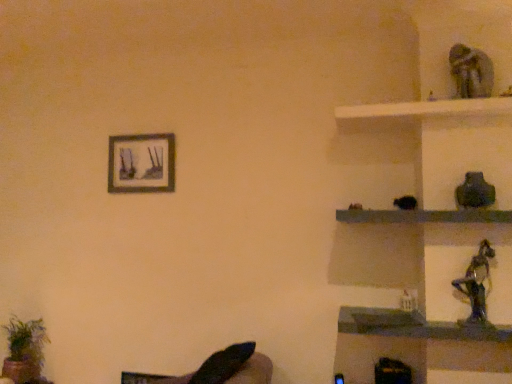
Question: Is black glossy statue at upper right, the 1th shelf in the top-to-bottom sequence, in front of green leafy plant at lower left?

Choices:
 (A) yes
 (B) no

Answer: (A)

Question: Does black glossy statue at upper right, the 1th shelf in the top-to-bottom sequence, have a lesser height compared to green leafy plant at lower left?

Choices:
 (A) yes
 (B) no

Answer: (A)

Question: Does black glossy statue at upper right, arranged as the second shelf when ordered from the bottom, appear on the right side of green leafy plant at lower left?

Choices:
 (A) no
 (B) yes

Answer: (B)

Question: Can you confirm if black glossy statue at upper right, arranged as the second shelf when ordered from the bottom, is thinner than green leafy plant at lower left?

Choices:
 (A) no
 (B) yes

Answer: (A)

Question: Is black glossy statue at upper right, the 1th shelf in the top-to-bottom sequence, outside green leafy plant at lower left?

Choices:
 (A) no
 (B) yes

Answer: (B)

Question: Can you confirm if black glossy statue at upper right, arranged as the second shelf when ordered from the bottom, is positioned to the left of green leafy plant at lower left?

Choices:
 (A) yes
 (B) no

Answer: (B)

Question: Considering the relative sizes of black glossy statue at upper right, arranged as the second shelf when ordered from the bottom, and shiny metallic figurine at right in the image provided, is black glossy statue at upper right, arranged as the second shelf when ordered from the bottom, taller than shiny metallic figurine at right?

Choices:
 (A) yes
 (B) no

Answer: (B)

Question: Is black glossy statue at upper right, arranged as the second shelf when ordered from the bottom, in contact with shiny metallic figurine at right?

Choices:
 (A) yes
 (B) no

Answer: (B)

Question: From a real-world perspective, does black glossy statue at upper right, arranged as the second shelf when ordered from the bottom, sit lower than shiny metallic figurine at right?

Choices:
 (A) yes
 (B) no

Answer: (B)

Question: Is black glossy statue at upper right, arranged as the second shelf when ordered from the bottom, closer to camera compared to shiny metallic figurine at right?

Choices:
 (A) no
 (B) yes

Answer: (B)

Question: From a real-world perspective, is black glossy statue at upper right, arranged as the second shelf when ordered from the bottom, on top of shiny metallic figurine at right?

Choices:
 (A) no
 (B) yes

Answer: (B)

Question: Is black glossy statue at upper right, arranged as the second shelf when ordered from the bottom, oriented towards shiny metallic figurine at right?

Choices:
 (A) no
 (B) yes

Answer: (A)

Question: From a real-world perspective, is green leafy plant at lower left on shiny metallic figurine at right?

Choices:
 (A) yes
 (B) no

Answer: (B)